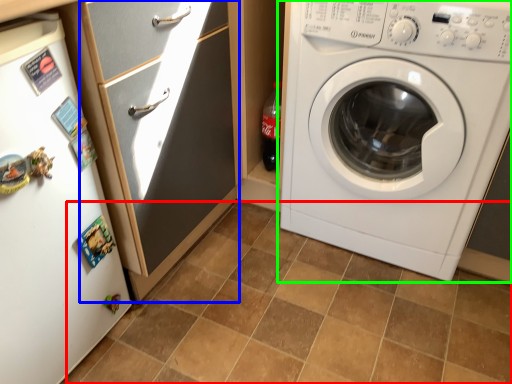
Question: Which object is the closest to the ceramic tile (highlighted by a red box)? Choose among these: screen door (highlighted by a blue box) or washing machine (highlighted by a green box).

Choices:
 (A) screen door
 (B) washing machine

Answer: (B)